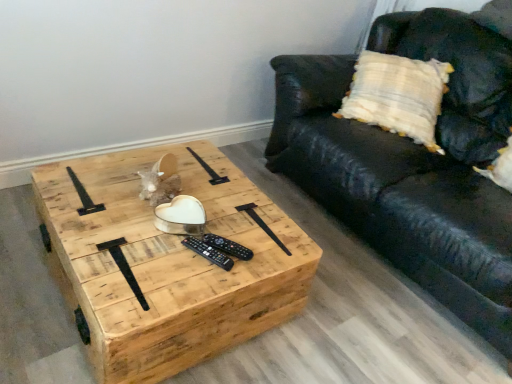
Question: Is black leather couch at center to the left or to the right of black plastic remote at center, which is the 1th remote from back to front, in the image?

Choices:
 (A) left
 (B) right

Answer: (B)

Question: In terms of size, does black leather couch at center appear bigger or smaller than black plastic remote at center, which is the 1th remote from back to front?

Choices:
 (A) small
 (B) big

Answer: (B)

Question: Based on their relative distances, which object is nearer to the black plastic remote at center, the 1th remote viewed from the front?

Choices:
 (A) natural wood coffee table at center
 (B) black plastic remote at center, the 2th remote when ordered from front to back
 (C) black leather couch at center

Answer: (B)

Question: Based on their relative distances, which object is nearer to the natural wood coffee table at center?

Choices:
 (A) black plastic remote at center, the 2th remote when ordered from front to back
 (B) black plastic remote at center, the 1th remote viewed from the front
 (C) black leather couch at center

Answer: (B)